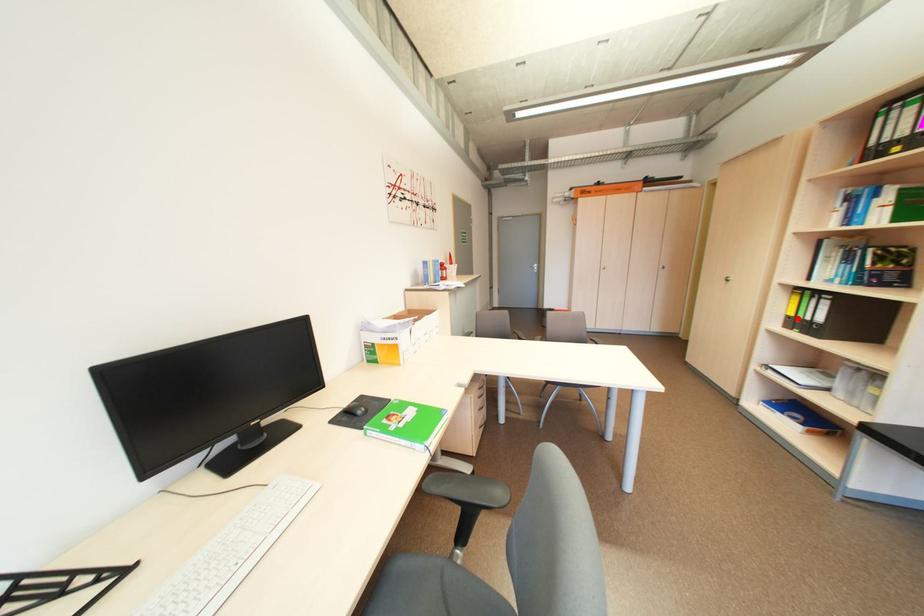
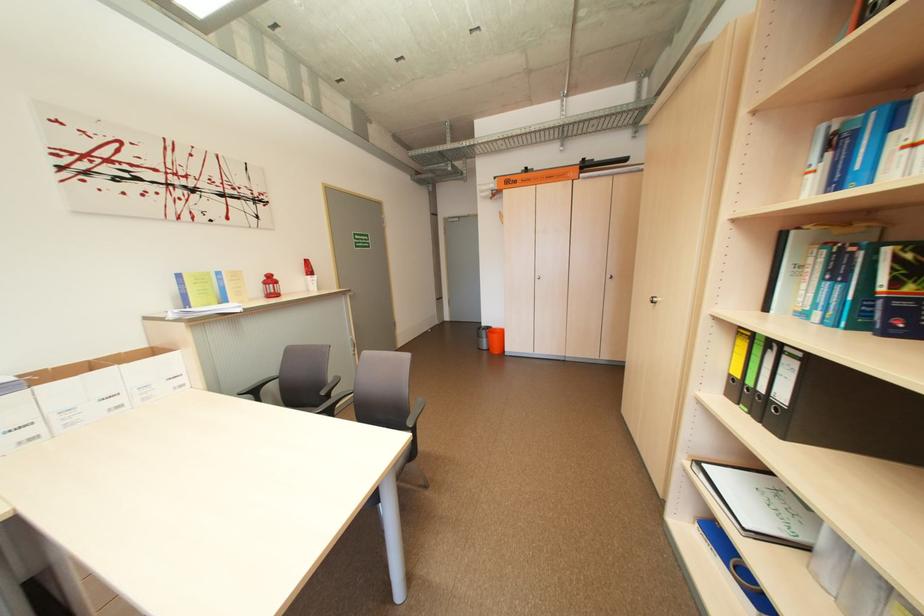
In the second image, find the point that corresponds to the highlighted location in the first image.

(743, 379)